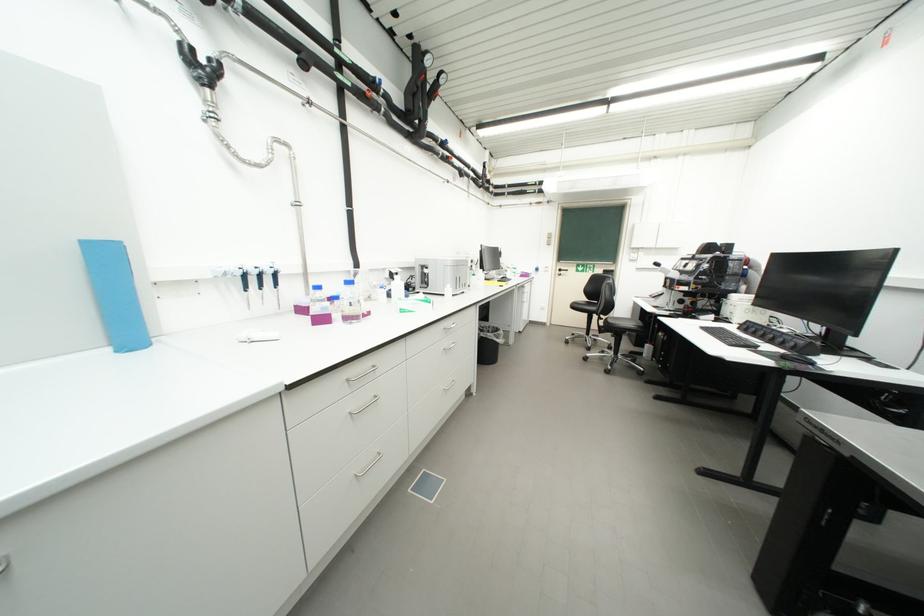
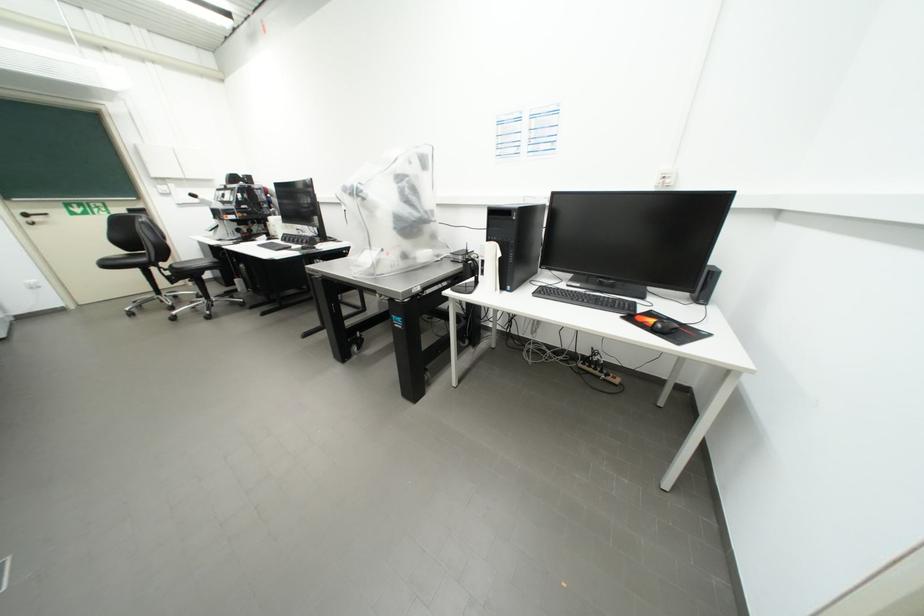
Find the pixel in the second image that matches (x=569, y=274) in the first image.

(43, 220)